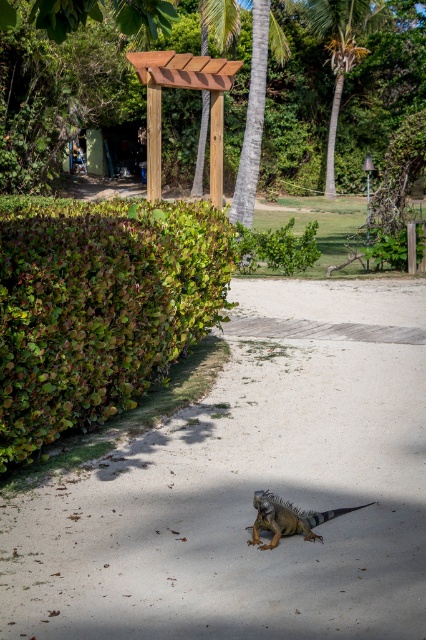
You are a small robot with a width of 30 cm. You need to move along the sandy pathway from the starting point to the end. The pathway is bordered by the green leafy hedge at left and the green scaly iguana at lower center. Can you safely pass between them without hitting either?

The green leafy hedge at left might be wider than the green scaly iguana at lower center, but since the exact width isn not provided, it is uncertain whether the pathway between them is wide enough for the robot to pass safely. Further measurements are needed.

You are a gardener planning to install a new pergola in your backyard. You see the wooden pergola at upper center and the green scaly iguana at lower center in the image. Which object is bigger in size?

The wooden pergola at upper center is larger in size compared to the green scaly iguana at lower center.

You are a gardener planning to install a new lighting system along the sandy pathway. The lights need to be placed at the base of the green leafy hedge at left and the wooden pergola at upper center. Which structure requires taller lights to accommodate its height?

The wooden pergola at upper center requires taller lights because it is taller than the green leafy hedge at left.